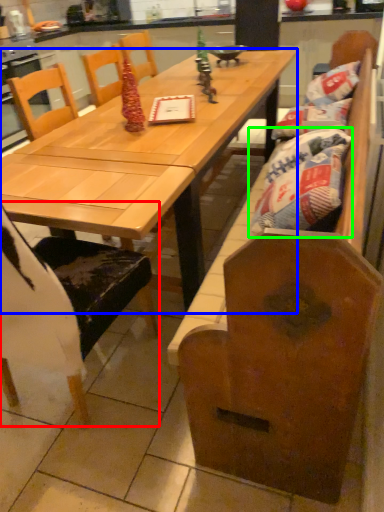
Question: Considering the real-world distances, which object is farthest from chair (highlighted by a red box)? table (highlighted by a blue box) or material (highlighted by a green box)?

Choices:
 (A) table
 (B) material

Answer: (B)